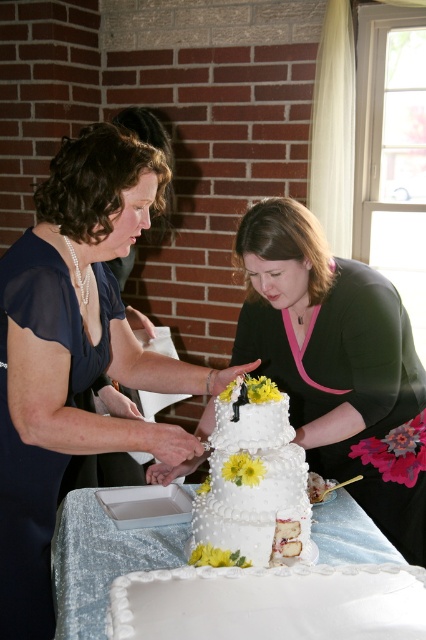
You are a photographer at the wedding, and you want to take a closeup shot of the white textured wedding cake at center without the white sequined tablecloth at center appearing in the background. Is this possible?

The white textured wedding cake at center is further to the viewer than the white sequined tablecloth at center, so the cake is closer to the camera. This means the tablecloth would be behind the cake, so taking a closeup shot of the cake would naturally obscure the tablecloth, making it possible to achieve the desired shot.